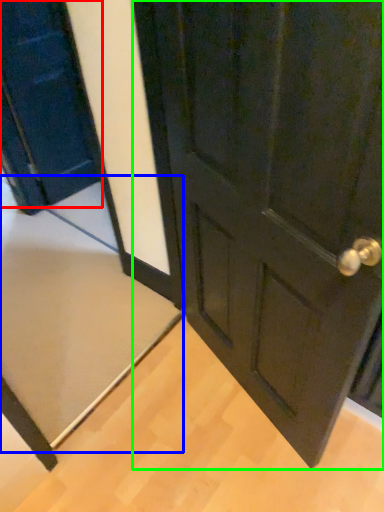
Question: Estimate the real-world distances between objects in this image. Which object is farther from door (highlighted by a red box), doormat (highlighted by a blue box) or door (highlighted by a green box)?

Choices:
 (A) doormat
 (B) door

Answer: (B)